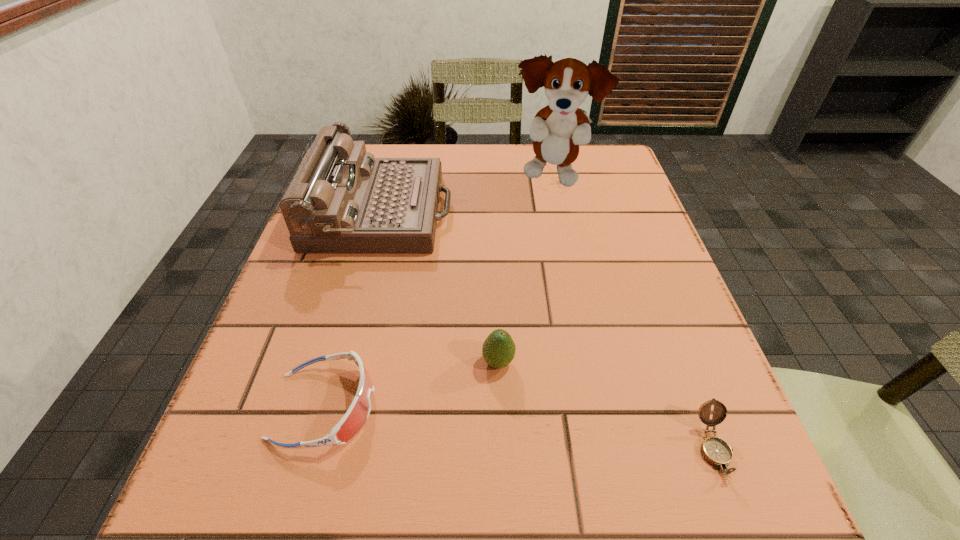
You are a GUI agent. You are given a task and a screenshot of the screen. Output one action in this format:
    pyautogui.click(x=<x>, y=<y>)
    Task: Click on the free space in the image that satisfies the following two spatial constraints: 1. on the keyboard of the typewriter; 2. on the right side of the third object from left to right
    
    Given the screenshot: What is the action you would take?
    343,362

Locate an element on the screen. vacant position in the image that satisfies the following two spatial constraints: 1. on the face of the second object from right to left; 2. on the keyboard of the fourth shortest object is located at coordinates (560, 212).

Find the location of `vacant position in the image that satisfies the following two spatial constraints: 1. on the face of the puppy; 2. on the keyboard of the second tallest object`. vacant position in the image that satisfies the following two spatial constraints: 1. on the face of the puppy; 2. on the keyboard of the second tallest object is located at coordinates (560, 212).